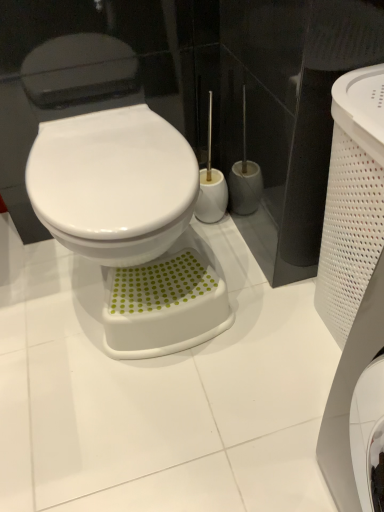
This screenshot has height=512, width=384. In order to click on free location above white glossy bidet at center (from a real-world perspective) in this screenshot , I will do pos(105,155).